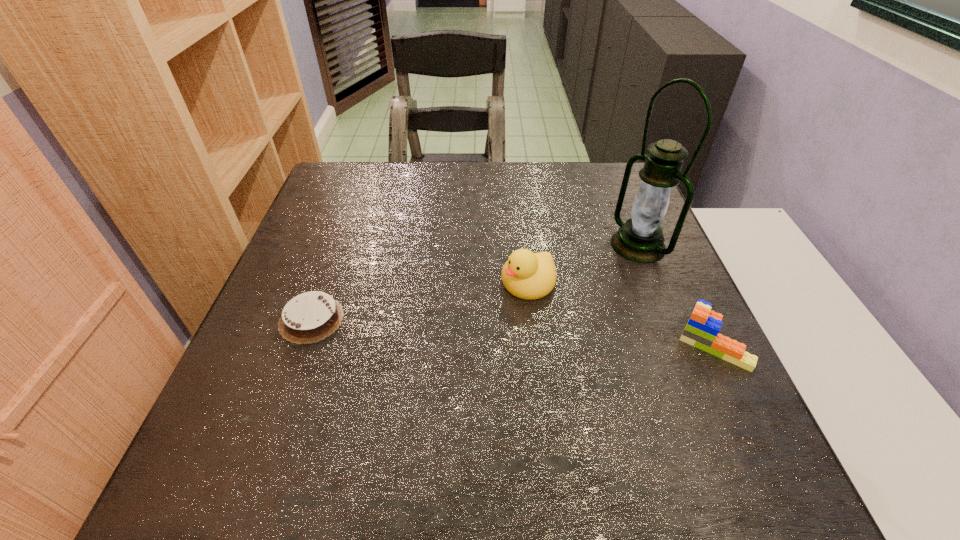
Where is `free space at the right edge of the desktop`? The image size is (960, 540). free space at the right edge of the desktop is located at coordinates coord(613,259).

Where is `free space at the near left corner of the desktop`? Image resolution: width=960 pixels, height=540 pixels. free space at the near left corner of the desktop is located at coordinates (279, 413).

In the image, there is a desktop. At what (x,y) coordinates should I click in order to perform the action: click on free space at the far right corner. Please return your answer as a coordinate pair (x, y). Looking at the image, I should click on (594, 185).

Where is `vacant space that is in between the shortest object and the second tallest object`? vacant space that is in between the shortest object and the second tallest object is located at coordinates (420, 301).

Where is `vacant area between the tallest object and the third shortest object`? vacant area between the tallest object and the third shortest object is located at coordinates (583, 264).

The width and height of the screenshot is (960, 540). I want to click on vacant space that's between the second tallest object and the lantern, so click(x=583, y=264).

Locate an element on the screen. The height and width of the screenshot is (540, 960). free space between the second tallest object and the second shortest object is located at coordinates (620, 312).

I want to click on unoccupied position between the shortest object and the lantern, so click(x=475, y=282).

The height and width of the screenshot is (540, 960). Find the location of `unoccupied area between the tallest object and the shortest object`. unoccupied area between the tallest object and the shortest object is located at coordinates (475, 282).

Locate an element on the screen. The height and width of the screenshot is (540, 960). free space between the Lego and the third object from right to left is located at coordinates (620, 312).